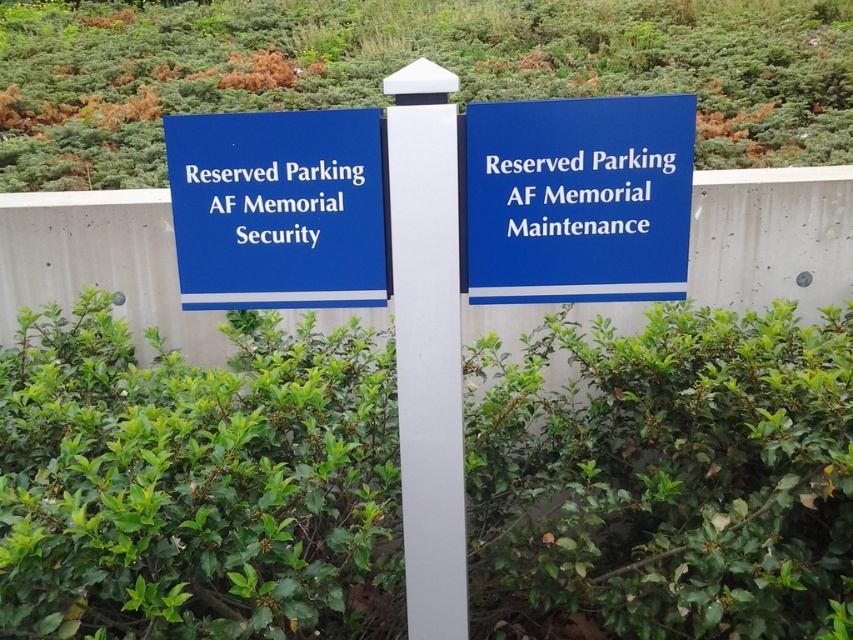
Question: Does green grass at upper center come in front of blue plastic sign at left?

Choices:
 (A) yes
 (B) no

Answer: (A)

Question: Estimate the real-world distances between objects in this image. Which object is farther from the green leafy hedge at center?

Choices:
 (A) white smooth pole at center
 (B) blue plastic sign at center
 (C) blue plastic sign at left
 (D) green grass at upper center

Answer: (D)

Question: Does green leafy hedge at center have a larger size compared to blue plastic sign at left?

Choices:
 (A) yes
 (B) no

Answer: (A)

Question: Which of the following is the closest to the observer?

Choices:
 (A) (538, 68)
 (B) (788, 465)
 (C) (590, 156)
 (D) (392, 202)

Answer: (D)

Question: Considering the relative positions of green leafy hedge at center and green grass at upper center in the image provided, where is green leafy hedge at center located with respect to green grass at upper center?

Choices:
 (A) above
 (B) below

Answer: (B)

Question: Which object is the farthest from the green grass at upper center?

Choices:
 (A) blue plastic sign at center
 (B) blue plastic sign at left
 (C) green leafy hedge at center
 (D) white smooth pole at center

Answer: (D)